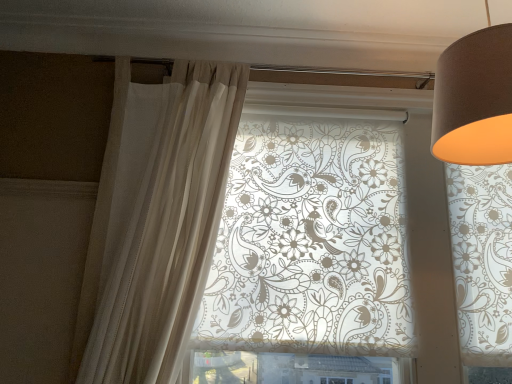
Question: Is the position of translucent floral-patterned roller blind at center more distant than that of matte brown lampshade at upper right?

Choices:
 (A) yes
 (B) no

Answer: (A)

Question: Is translucent floral-patterned roller blind at center taller than matte brown lampshade at upper right?

Choices:
 (A) yes
 (B) no

Answer: (A)

Question: Considering the relative sizes of translucent floral-patterned roller blind at center and matte brown lampshade at upper right in the image provided, is translucent floral-patterned roller blind at center thinner than matte brown lampshade at upper right?

Choices:
 (A) no
 (B) yes

Answer: (B)

Question: Can you confirm if translucent floral-patterned roller blind at center is bigger than matte brown lampshade at upper right?

Choices:
 (A) yes
 (B) no

Answer: (A)

Question: Can matte brown lampshade at upper right be found inside translucent floral-patterned roller blind at center?

Choices:
 (A) yes
 (B) no

Answer: (B)

Question: In terms of width, does translucent floral-patterned roller blind at center look wider or thinner when compared to sheer white curtain at left?

Choices:
 (A) wide
 (B) thin

Answer: (A)

Question: From the image's perspective, is translucent floral-patterned roller blind at center above or below sheer white curtain at left?

Choices:
 (A) below
 (B) above

Answer: (A)

Question: Is translucent floral-patterned roller blind at center taller or shorter than sheer white curtain at left?

Choices:
 (A) short
 (B) tall

Answer: (A)

Question: Considering the positions of translucent floral-patterned roller blind at center and sheer white curtain at left in the image, is translucent floral-patterned roller blind at center bigger or smaller than sheer white curtain at left?

Choices:
 (A) big
 (B) small

Answer: (A)

Question: From a real-world perspective, relative to sheer white curtain at left, is matte brown lampshade at upper right vertically above or below?

Choices:
 (A) above
 (B) below

Answer: (A)

Question: From the image's perspective, is matte brown lampshade at upper right positioned above or below sheer white curtain at left?

Choices:
 (A) below
 (B) above

Answer: (B)

Question: Based on their sizes in the image, would you say matte brown lampshade at upper right is bigger or smaller than sheer white curtain at left?

Choices:
 (A) big
 (B) small

Answer: (B)

Question: Does point (508, 147) appear closer or farther from the camera than point (238, 110)?

Choices:
 (A) farther
 (B) closer

Answer: (B)

Question: Considering the positions of translucent floral-patterned roller blind at center and matte brown lampshade at upper right in the image, is translucent floral-patterned roller blind at center wider or thinner than matte brown lampshade at upper right?

Choices:
 (A) thin
 (B) wide

Answer: (A)

Question: Does point click(x=415, y=286) appear closer or farther from the camera than point click(x=473, y=119)?

Choices:
 (A) closer
 (B) farther

Answer: (B)